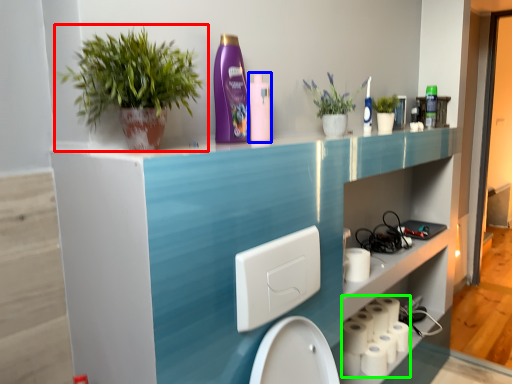
Question: Which object is positioned farthest from houseplant (highlighted by a red box)? Select from cleaning product (highlighted by a blue box) and toilet paper (highlighted by a green box).

Choices:
 (A) cleaning product
 (B) toilet paper

Answer: (B)